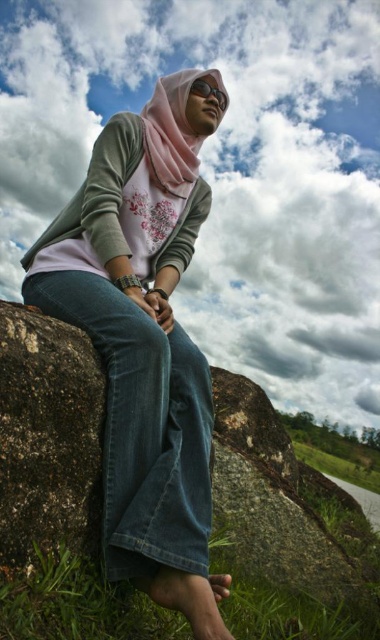
Question: Which is nearer to the pink satin hijab at upper center?

Choices:
 (A) cloudy sky at upper center
 (B) matte black goggles at upper center
 (C) pink fabric hijab at center

Answer: (B)

Question: Which of these objects is positioned farthest from the pink fabric hijab at center?

Choices:
 (A) matte black goggles at upper center
 (B) cloudy sky at upper center

Answer: (B)

Question: Does green grass at lower left appear on the left side of pink satin hijab at upper center?

Choices:
 (A) yes
 (B) no

Answer: (B)

Question: Is pink fabric hijab at center wider than rough textured rock at lower right?

Choices:
 (A) yes
 (B) no

Answer: (B)

Question: Which object is closer to the camera taking this photo?

Choices:
 (A) matte black goggles at upper center
 (B) green grass at lower left
 (C) rough textured rock at lower right
 (D) cloudy sky at upper center

Answer: (B)

Question: Is cloudy sky at upper center positioned before pink satin hijab at upper center?

Choices:
 (A) no
 (B) yes

Answer: (A)